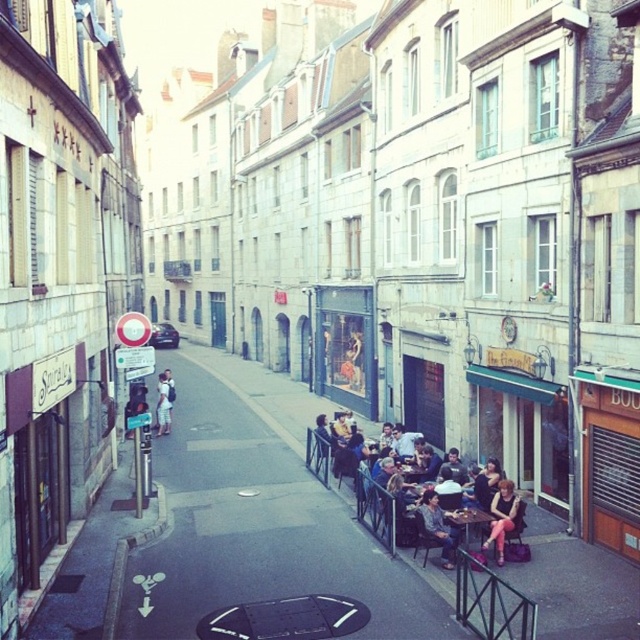
You are standing at the center of the street looking towards the specialty store on the left. There is a point marked at coordinates (502, 516) which corresponds to an object in the image. What object is located at that point?

The point at coordinates (502, 516) marks the denim shorts at lower right.